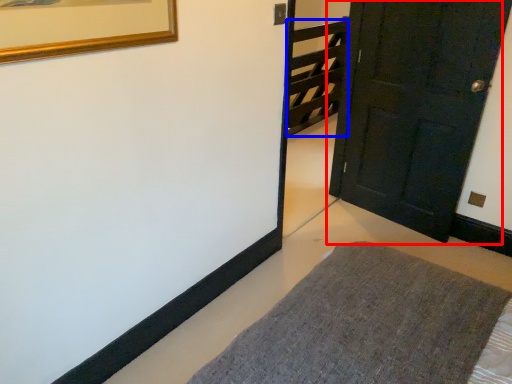
Question: Which object appears farthest to the camera in this image, door (highlighted by a red box) or stairwell (highlighted by a blue box)?

Choices:
 (A) door
 (B) stairwell

Answer: (B)